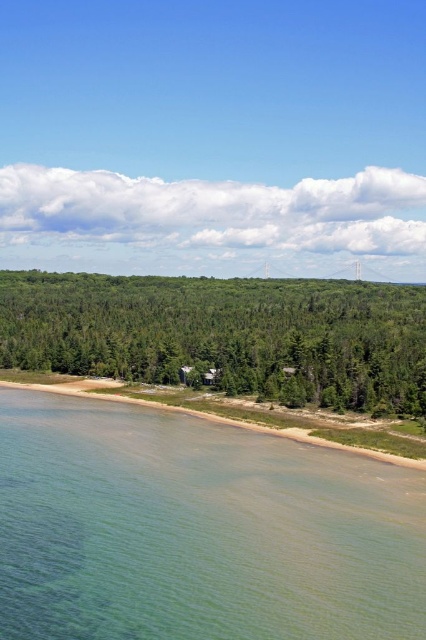
Does clear water at lower left have a lesser width compared to green leafy trees at center?

Correct, clear water at lower left's width is less than green leafy trees at center's.

Is clear water at lower left below green leafy trees at center?

Correct, clear water at lower left is located below green leafy trees at center.

At what (x,y) coordinates should I click in order to perform the action: click on clear water at lower left. Please return your answer as a coordinate pair (x, y). This screenshot has width=426, height=640. Looking at the image, I should click on (198, 531).